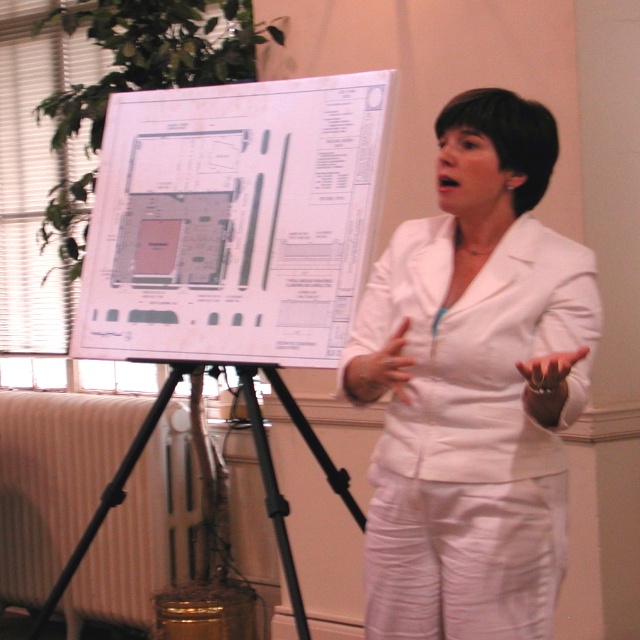
You are a photographer setting up for an event. You need to position a camera on a tripod such that it can capture the speaker clearly while avoiding blocking the audience. The speaker is wearing a white matte blazer at center and standing near a black matte tripod at center. Given that the distance between them is 27.86 inches, is this distance sufficient for the speaker to move comfortably without bumping into the tripod?

The distance between the white matte blazer at center and the black matte tripod at center is 27.86 inches. This distance allows the speaker to move comfortably without bumping into the tripod, as 27.86 inches provides enough space for natural movement during the presentation.

You are an architect holding a 20 cm wide model. You need to place it on the white paper at center or the black matte tripod at center. Which surface can accommodate the model without exceeding its width?

The black matte tripod at center has a wider width than the white paper at center. Since the model is 20 cm wide, the black matte tripod at center can accommodate it without exceeding its width.

You are an architect attending a presentation and notice the white paper at center and the black matte tripod at center. Which object is positioned higher in the image?

The white paper at center is located above the black matte tripod at center, so it is positioned higher in the image.